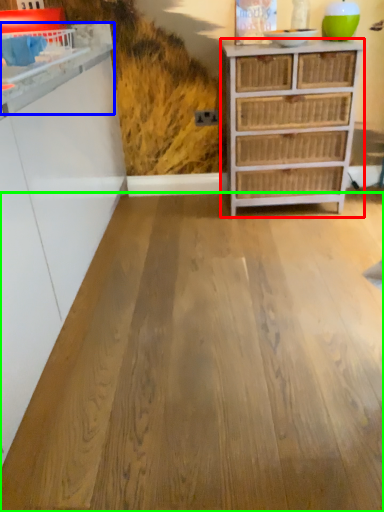
Question: Considering the real-world distances, which object is closest to chest of drawers (highlighted by a red box)? counter (highlighted by a blue box) or plywood (highlighted by a green box).

Choices:
 (A) counter
 (B) plywood

Answer: (B)